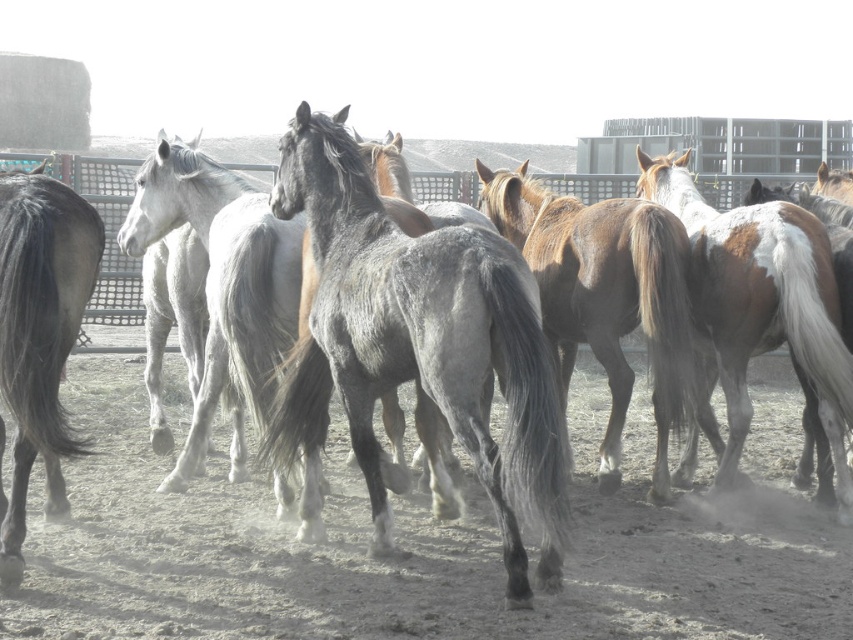
You are a farmer who wants to separate the gray textured horse at center and the gray matte horse at left using a temporary fence. Since the temporary fence can only be placed between them, where should you place it?

You should place the temporary fence between the gray textured horse at center and the gray matte horse at left since the gray textured horse at center is in front of the gray matte horse at left, creating a clear space to separate them.